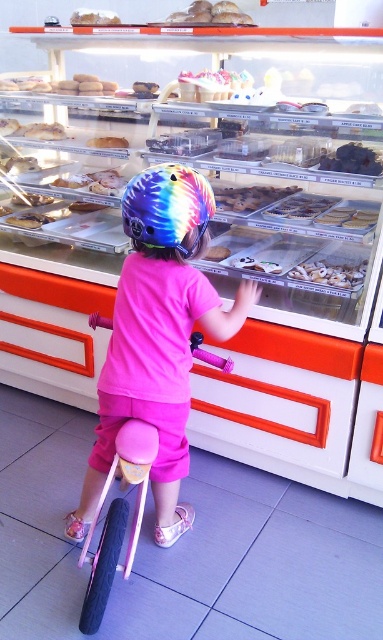
Between point (342, 262) and point (99, 17), which one is positioned behind?

Point (99, 17)

Can you confirm if white frosted pastry at center is taller than smooth white bread at upper center?

No, white frosted pastry at center is not taller than smooth white bread at upper center.

Who is more forward, [335,288] or [70,19]?

Point [335,288] is in front.

Locate an element on the screen. This screenshot has width=383, height=640. white frosted pastry at center is located at coordinates (330, 275).

Who is higher up, tie-dye fabric helmet at center or smooth chocolate cookie at center?

tie-dye fabric helmet at center is above.

Does tie-dye fabric helmet at center have a lesser height compared to smooth chocolate cookie at center?

No, tie-dye fabric helmet at center is not shorter than smooth chocolate cookie at center.

Is point (163, 182) positioned before point (224, 250)?

That is True.

This screenshot has width=383, height=640. In order to click on tie-dye fabric helmet at center in this screenshot , I will do `click(166, 205)`.

What do you see at coordinates (158, 336) in the screenshot? I see `rainbow helmet at center` at bounding box center [158, 336].

Is point (109, 420) positioned after point (332, 285)?

No.

Identify the location of rainbow helmet at center. This screenshot has height=640, width=383. (158, 336).